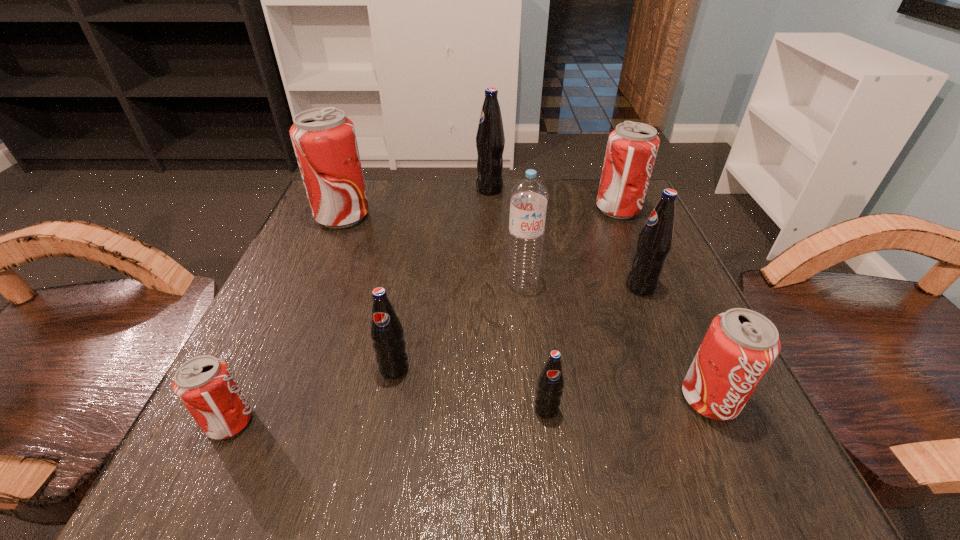
Identify the location of the farthest pop. (490, 140).

Where is `the farthest black pop`? This screenshot has height=540, width=960. the farthest black pop is located at coordinates (490, 140).

You are a GUI agent. You are given a task and a screenshot of the screen. Output one action in this format:
    pyautogui.click(x=<x>, y=<y>)
    Task: Click on the biggest pink soda can
    
    Given the screenshot: What is the action you would take?
    pyautogui.click(x=324, y=140)

Identify the location of water bottle. This screenshot has width=960, height=540. (528, 198).

Find the location of a particular element. the second biggest pink soda can is located at coordinates (632, 147).

In order to click on the third smallest black pop in this screenshot , I will do `click(654, 243)`.

Where is `the rightmost black pop`? This screenshot has width=960, height=540. the rightmost black pop is located at coordinates (654, 243).

I want to click on the third biggest black pop, so click(x=386, y=331).

Image resolution: width=960 pixels, height=540 pixels. In order to click on the sixth pop from right to left in this screenshot , I will do `click(386, 331)`.

Where is `the third biggest pink soda can`? The height and width of the screenshot is (540, 960). the third biggest pink soda can is located at coordinates (740, 346).